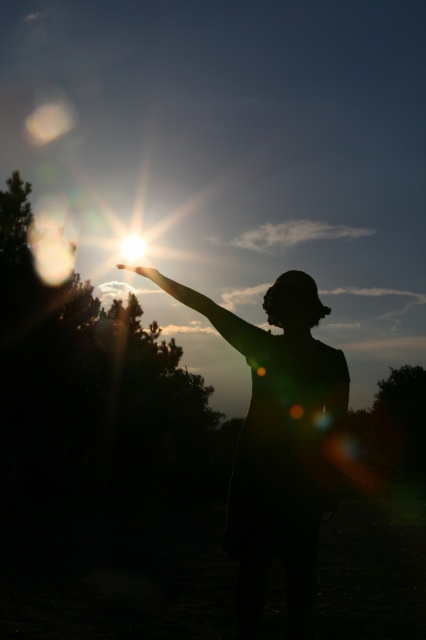
Question: Which object is farther from the camera taking this photo?

Choices:
 (A) transparent glass hand at upper center
 (B) silhouette arm at upper center
 (C) silhouette fabric at center

Answer: (A)

Question: Can you confirm if silhouette fabric at center is positioned to the right of transparent glass hand at upper center?

Choices:
 (A) no
 (B) yes

Answer: (B)

Question: Which point appears closest to the camera in this image?

Choices:
 (A) (270, 339)
 (B) (256, 595)

Answer: (B)

Question: Estimate the real-world distances between objects in this image. Which object is closer to the silhouette fabric at center?

Choices:
 (A) transparent glass hand at upper center
 (B) silhouette arm at upper center

Answer: (B)

Question: Considering the relative positions of silhouette fabric at center and silhouette arm at upper center in the image provided, where is silhouette fabric at center located with respect to silhouette arm at upper center?

Choices:
 (A) left
 (B) right

Answer: (B)

Question: Can you confirm if silhouette fabric at center is positioned below transparent glass hand at upper center?

Choices:
 (A) yes
 (B) no

Answer: (A)